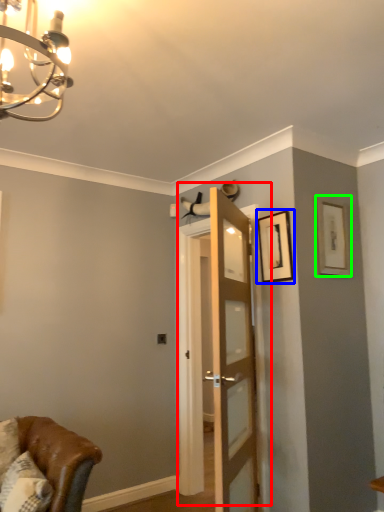
Question: Considering the real-world distances, which object is closest to door (highlighted by a red box)? picture frame (highlighted by a blue box) or picture frame (highlighted by a green box).

Choices:
 (A) picture frame
 (B) picture frame

Answer: (A)